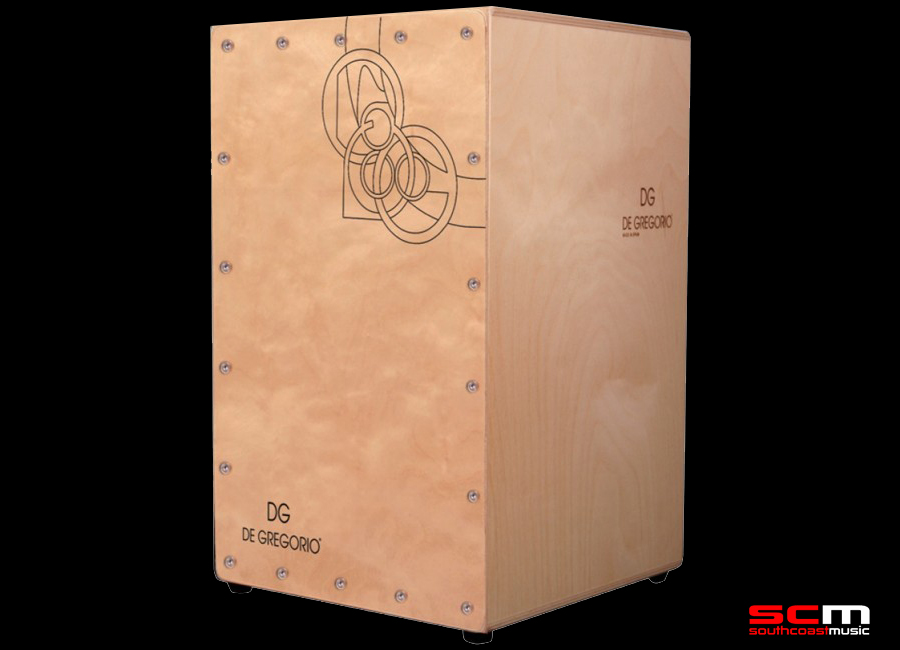
Image resolution: width=900 pixels, height=650 pixels. Identify the location of plywood. 581,593, 624,23.